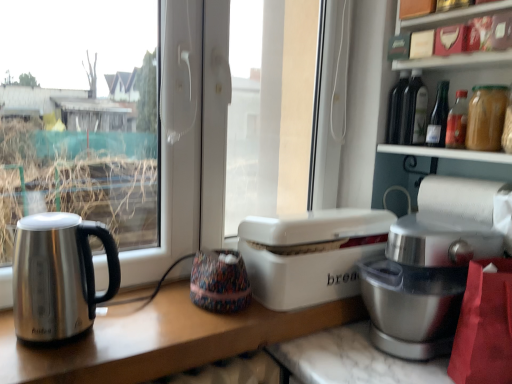
Question: Visually, is satin silver mixer at right positioned to the left or to the right of white paper at right?

Choices:
 (A) right
 (B) left

Answer: (B)

Question: Based on their sizes in the image, would you say satin silver mixer at right is bigger or smaller than white paper at right?

Choices:
 (A) small
 (B) big

Answer: (B)

Question: Considering the real-world distances, which object is farthest from the matte glass bottles at upper right?

Choices:
 (A) satin silver mixer at right
 (B) stainless steel kettle at left
 (C) white paper at right
 (D) translucent glass bottle at upper right, marked as the first bottle in a back-to-front arrangement
 (E) translucent glass bottle at upper right, which is the second bottle in back-to-front order

Answer: (B)

Question: Considering the real-world distances, which object is closest to the white paper at right?

Choices:
 (A) matte glass bottles at upper right
 (B) stainless steel kettle at left
 (C) translucent glass bottle at upper right, placed as the first bottle when sorted from front to back
 (D) satin silver mixer at right
 (E) white plastic bread bin at center

Answer: (D)